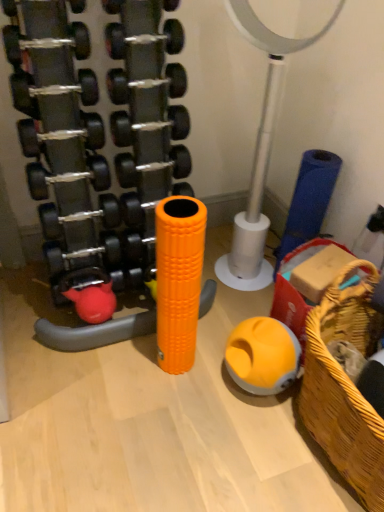
At what (x,y) coordinates should I click in order to perform the action: click on free space between rubberized yellow ball at center, which appears as the second toy when viewed from the left, and orange foam roller at center, the 2th toy positioned from the right. Please return your answer as a coordinate pair (x, y). Looking at the image, I should click on (211, 374).